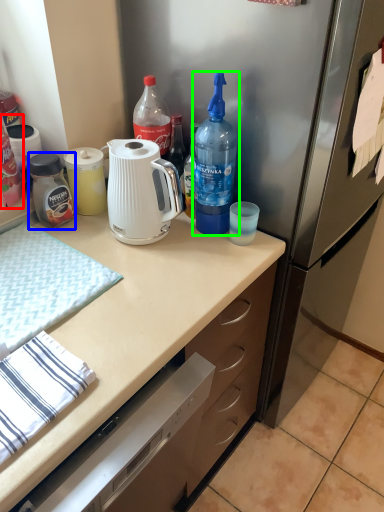
Question: Which is farther away from bottle (highlighted by a red box)? bottle (highlighted by a blue box) or bottle (highlighted by a green box)?

Choices:
 (A) bottle
 (B) bottle

Answer: (B)